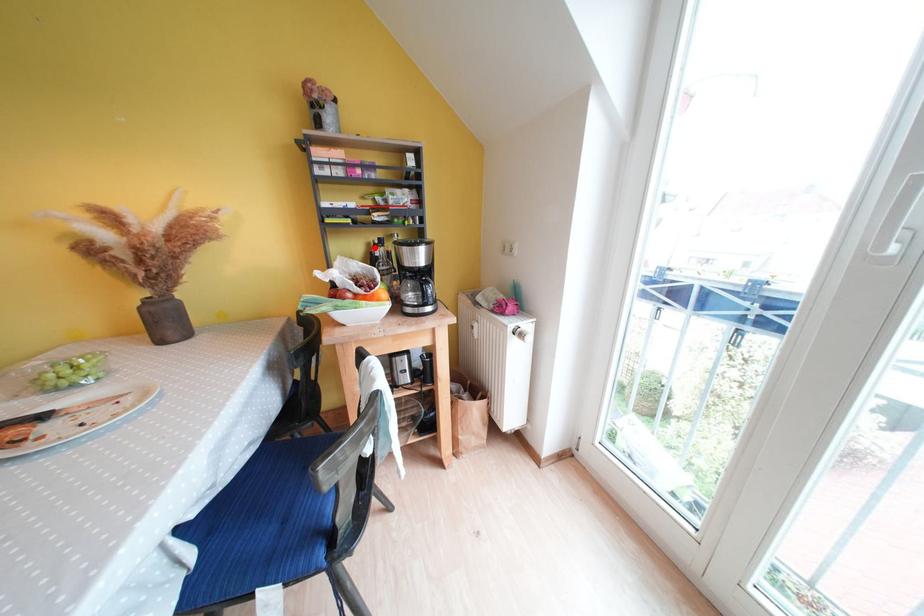
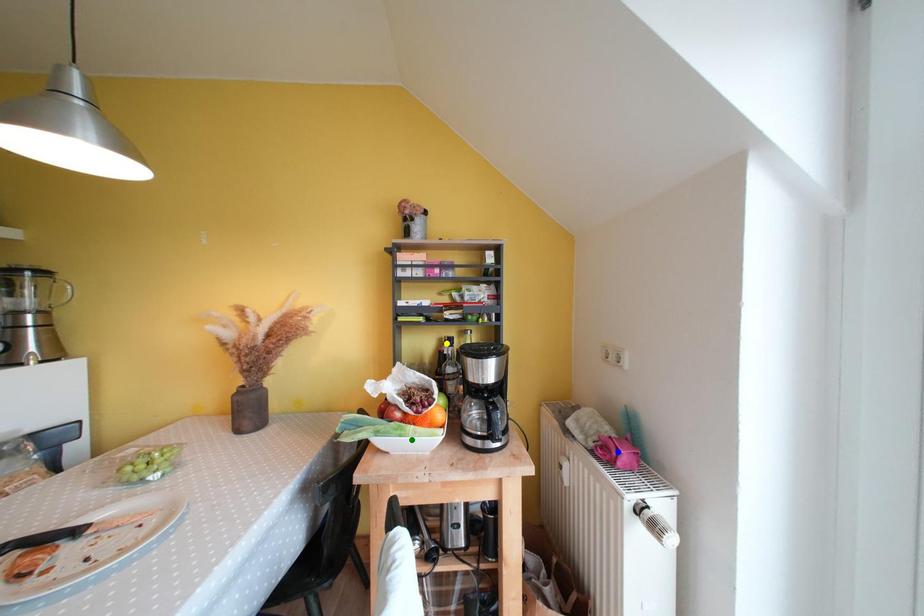
Question: I am providing you with two images of the same scene from different viewpoints. A red point is marked on the first image. You are given multiple points on the second image. Can you choose the point in image 2 that corresponds to the point in image 1?

Choices:
 (A) yellow point
 (B) green point
 (C) blue point

Answer: (A)